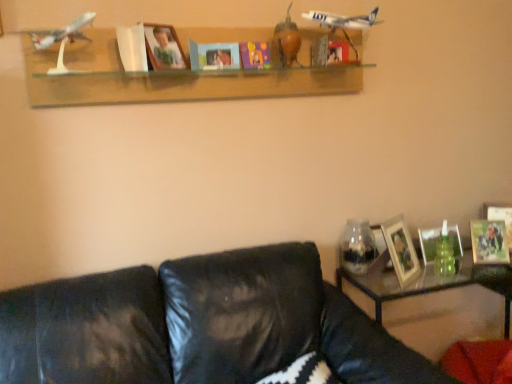
Describe the element at coordinates (174, 77) in the screenshot. I see `wooden shelf at upper center` at that location.

You are a GUI agent. You are given a task and a screenshot of the screen. Output one action in this format:
    pyautogui.click(x=<x>, y=<y>)
    Task: Click on the transparent glass jar at right
    This screenshot has width=512, height=384.
    Given the screenshot: What is the action you would take?
    pyautogui.click(x=357, y=247)

What do you see at coordinates (255, 55) in the screenshot? Image resolution: width=512 pixels, height=384 pixels. I see `matte purple paper at center, which ranks as the 1th paperback book in right-to-left order` at bounding box center [255, 55].

Describe the element at coordinates (489, 242) in the screenshot. I see `metallic silver photo frame at right, the fourth picture frame when ordered from top to bottom` at that location.

What is the approximate width of metallic silver photo frame at right, which is counted as the 2th picture frame, starting from the bottom?

metallic silver photo frame at right, which is counted as the 2th picture frame, starting from the bottom, is 5.62 inches in width.

The image size is (512, 384). Describe the element at coordinates (132, 48) in the screenshot. I see `white matte paperback book at upper center, the 3th paperback book from the right` at that location.

Find the location of a particular element. The width and height of the screenshot is (512, 384). matte brown acorn at upper center is located at coordinates [x=286, y=42].

Locate an element on the screen. The image size is (512, 384). wooden shelf at upper center is located at coordinates (174, 77).

Is point (215, 50) closer to viewer compared to point (507, 217)?

Yes, it is.

Could you tell me if blue matte book at center, which is counted as the second paperback book, starting from the right, is facing wooden photo frame at right, the 1th picture frame from the right?

No, blue matte book at center, which is counted as the second paperback book, starting from the right, is not facing towards wooden photo frame at right, the 1th picture frame from the right.

Could you measure the distance between blue matte book at center, which is counted as the second paperback book, starting from the right, and wooden photo frame at right, which is the fifth picture frame in left-to-right order?

They are 5.07 feet apart.

Are blue matte book at center, which is counted as the second paperback book, starting from the right, and wooden photo frame at right, which is the fifth picture frame in left-to-right order, beside each other?

No.

From a real-world perspective, between blue matte book at center, which is counted as the second paperback book, starting from the right, and black leather couch at lower left, who is vertically lower?

In real-world perspective, black leather couch at lower left is lower.

Is blue matte book at center, which is counted as the second paperback book, starting from the right, not within black leather couch at lower left?

Yes, blue matte book at center, which is counted as the second paperback book, starting from the right, is outside of black leather couch at lower left.

From the image's perspective, which object appears higher, blue matte book at center, which is counted as the second paperback book, starting from the right, or black leather couch at lower left?

blue matte book at center, which is counted as the second paperback book, starting from the right, appears higher in the image.

Between blue matte book at center, the 2th paperback book positioned from the left, and black textured pillow at lower center, which one is positioned in front?

black textured pillow at lower center is closer to the camera.

Is black textured pillow at lower center completely or partially inside blue matte book at center, which is counted as the second paperback book, starting from the right?

That's incorrect, black textured pillow at lower center is not inside blue matte book at center, which is counted as the second paperback book, starting from the right.

From the image's perspective, which one is positioned higher, blue matte book at center, which is counted as the second paperback book, starting from the right, or black textured pillow at lower center?

blue matte book at center, which is counted as the second paperback book, starting from the right, appears higher in the image.

Based on the photo, looking at their sizes, would you say blue matte book at center, which is counted as the second paperback book, starting from the right, is wider or thinner than black textured pillow at lower center?

Considering their sizes, blue matte book at center, which is counted as the second paperback book, starting from the right, looks slimmer than black textured pillow at lower center.

Would you say black leather couch at lower left contains transparent glass jar at right?

That's incorrect, transparent glass jar at right is not inside black leather couch at lower left.

Considering the positions of point (58, 325) and point (364, 248), is point (58, 325) closer or farther from the camera than point (364, 248)?

Point (58, 325).

Considering the relative sizes of black leather couch at lower left and transparent glass jar at right in the image provided, is black leather couch at lower left shorter than transparent glass jar at right?

No, black leather couch at lower left is not shorter than transparent glass jar at right.

Are black leather couch at lower left and transparent glass jar at right located far from each other?

black leather couch at lower left is actually quite close to transparent glass jar at right.

Between metallic silver photo frame at right, which is counted as the 2th picture frame, starting from the bottom, and clear glass table at lower right, which one has larger size?

clear glass table at lower right is bigger.

Considering the positions of objects metallic silver photo frame at right, which is counted as the 2th picture frame, starting from the bottom, and clear glass table at lower right in the image provided, who is more to the left, metallic silver photo frame at right, which is counted as the 2th picture frame, starting from the bottom, or clear glass table at lower right?

From the viewer's perspective, clear glass table at lower right appears more on the left side.

From the picture: Does metallic silver photo frame at right, the 4th picture frame from the left, lie behind clear glass table at lower right?

Yes, it is behind clear glass table at lower right.

From the image's perspective, which one is positioned higher, metallic silver photo frame at right, arranged as the second picture frame when viewed from the right, or clear glass table at lower right?

From the image's view, metallic silver photo frame at right, arranged as the second picture frame when viewed from the right, is above.

In order to click on studio couch located underneath the metallic silver photo frame at right, the fourth picture frame when ordered from top to bottom (from a real-world perspective) in this screenshot , I will do `click(199, 325)`.

Can you confirm if metallic silver photo frame at right, which is counted as the 2th picture frame, starting from the bottom, is bigger than black leather couch at lower left?

Actually, metallic silver photo frame at right, which is counted as the 2th picture frame, starting from the bottom, might be smaller than black leather couch at lower left.

From the image's perspective, is metallic silver photo frame at right, which is counted as the 2th picture frame, starting from the bottom, located above or below black leather couch at lower left?

Clearly, from the image's perspective, metallic silver photo frame at right, which is counted as the 2th picture frame, starting from the bottom, is above black leather couch at lower left.

Can you confirm if matte glass picture frame at right, the third picture frame positioned from the right, is thinner than wooden shelf at upper center?

Indeed, matte glass picture frame at right, the third picture frame positioned from the right, has a lesser width compared to wooden shelf at upper center.

Is matte glass picture frame at right, acting as the 3th picture frame starting from the top, placed right next to wooden shelf at upper center?

No, matte glass picture frame at right, acting as the 3th picture frame starting from the top, is not in contact with wooden shelf at upper center.

Based on the photo, could you tell me if matte glass picture frame at right, the third picture frame positioned from the right, is facing wooden shelf at upper center?

No, matte glass picture frame at right, the third picture frame positioned from the right, is not facing towards wooden shelf at upper center.

Is matte glass picture frame at right, the third picture frame positioned from the right, taller than wooden shelf at upper center?

In fact, matte glass picture frame at right, the third picture frame positioned from the right, may be shorter than wooden shelf at upper center.

The height and width of the screenshot is (384, 512). Find the location of `the 2nd paperback book to the left of the wooden photo frame at right, acting as the 4th picture frame starting from the bottom, starting your count from the anchor`. the 2nd paperback book to the left of the wooden photo frame at right, acting as the 4th picture frame starting from the bottom, starting your count from the anchor is located at coordinates (214, 56).

At what (x,y) coordinates should I click in order to perform the action: click on the 2nd paperback book positioned above the black leather couch at lower left (from the image's perspective). Please return your answer as a coordinate pair (x, y). The width and height of the screenshot is (512, 384). Looking at the image, I should click on (214, 56).

Considering their positions, is white matte paperback book at upper center, the 1th paperback book viewed from the left, positioned further to matte purple paper at center, which ranks as the 1th paperback book in right-to-left order, than wooden photo frame at right, which is the fifth picture frame in left-to-right order?

wooden photo frame at right, which is the fifth picture frame in left-to-right order, lies further to matte purple paper at center, which ranks as the 1th paperback book in right-to-left order, than the other object.

Looking at the image, which one is located closer to white matte paperback book at upper center, the 3th paperback book from the right, metallic silver photo frame at right, the fourth picture frame when ordered from top to bottom, or matte purple paper at center, which ranks as the 1th paperback book in right-to-left order?

matte purple paper at center, which ranks as the 1th paperback book in right-to-left order, is positioned closer to the anchor white matte paperback book at upper center, the 3th paperback book from the right.

Considering their positions, is white matte paperback book at upper center, the 1th paperback book viewed from the left, positioned closer to matte purple paper at center, which is the third paperback book in left-to-right order, than clear glass table at lower right?

Based on the image, white matte paperback book at upper center, the 1th paperback book viewed from the left, appears to be nearer to matte purple paper at center, which is the third paperback book in left-to-right order.

Looking at the image, which one is located further to matte purple paper at center, which is the third paperback book in left-to-right order, blue matte book at center, the 2th paperback book positioned from the left, or white matte paperback book at upper center, the 1th paperback book viewed from the left?

white matte paperback book at upper center, the 1th paperback book viewed from the left, is further to matte purple paper at center, which is the third paperback book in left-to-right order.

Looking at the image, which one is located closer to metallic silver photo frame at right, arranged as the second picture frame when viewed from the right, matte glass picture frame at right, which is counted as the 3th picture frame, starting from the bottom, or black leather couch at lower left?

matte glass picture frame at right, which is counted as the 3th picture frame, starting from the bottom, is positioned closer to the anchor metallic silver photo frame at right, arranged as the second picture frame when viewed from the right.

When comparing their distances from metallic silver photo frame at right, which is counted as the 2th picture frame, starting from the bottom, does wooden shelf at upper center or matte brown acorn at upper center seem further?

wooden shelf at upper center.

When comparing their distances from clear glass table at lower right, does wooden photo frame at right, the 1th picture frame from the right, or matte purple paper at center, which is the third paperback book in left-to-right order, seem closer?

Among the two, wooden photo frame at right, the 1th picture frame from the right, is located nearer to clear glass table at lower right.

Estimate the real-world distances between objects in this image. Which object is closer to wooden photo frame at right, acting as the 4th picture frame starting from the bottom, wooden photo frame at right, the first picture frame ordered from the bottom, or transparent glass jar at right?

wooden photo frame at right, the first picture frame ordered from the bottom.

You are a GUI agent. You are given a task and a screenshot of the screen. Output one action in this format:
    pyautogui.click(x=<x>, y=<y>)
    Task: Click on the pillow located between blue matte book at center, the 2th paperback book positioned from the left, and metallic silver photo frame at right, the fourth picture frame when ordered from top to bottom, in the left-right direction
    Image resolution: width=512 pixels, height=384 pixels.
    Given the screenshot: What is the action you would take?
    pyautogui.click(x=303, y=372)

Locate an element on the screen. Image resolution: width=512 pixels, height=384 pixels. toy between wooden photo frame at upper center, the first picture frame from the left, and metallic silver photo frame at right, which is counted as the 2th picture frame, starting from the bottom, in the horizontal direction is located at coordinates (286, 42).

Find the location of `glass vase located between wooden photo frame at upper center, the first picture frame from the left, and wooden photo frame at right, placed as the fourth picture frame when sorted from right to left, in the left-right direction`. glass vase located between wooden photo frame at upper center, the first picture frame from the left, and wooden photo frame at right, placed as the fourth picture frame when sorted from right to left, in the left-right direction is located at coordinates (357, 247).

In order to click on glass vase located between wooden photo frame at upper center, the fifth picture frame from the bottom, and clear glass table at lower right in the left-right direction in this screenshot , I will do `click(357, 247)`.